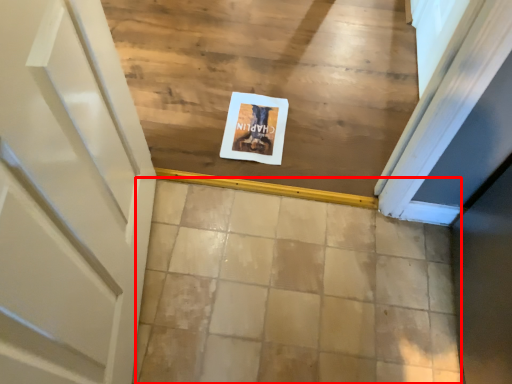
Question: From the image's perspective, where is tile (annotated by the red box) located in relation to postcard in the image?

Choices:
 (A) above
 (B) below

Answer: (B)